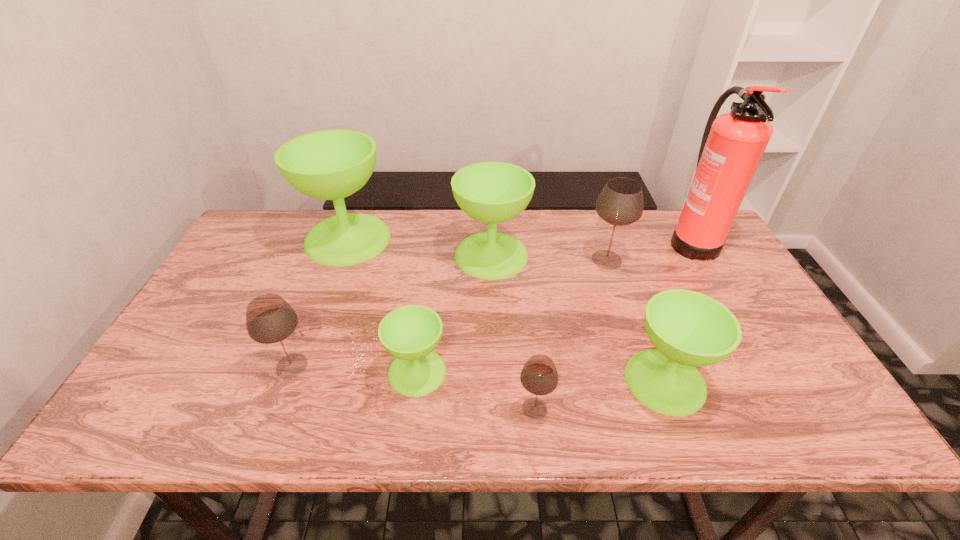
Identify the location of the third closest object to the second biggest green wineglass. (410, 333).

Locate an element on the screen. The width and height of the screenshot is (960, 540). the third closest wineglass relative to the sixth object from right to left is located at coordinates (491, 192).

I want to click on wineglass that stands as the third closest to the second biggest green wineglass, so click(x=410, y=333).

Locate an element on the screen. green wineglass that stands as the closest to the fifth wineglass from right to left is located at coordinates (491, 192).

Image resolution: width=960 pixels, height=540 pixels. I want to click on green wineglass that is the nearest to the second biggest green wineglass, so click(330, 164).

I want to click on the second closest gray wineglass relative to the nearest gray wineglass, so click(270, 319).

The image size is (960, 540). In order to click on gray wineglass that is the third closest to the third biggest green wineglass in this screenshot , I will do `click(270, 319)`.

At what (x,y) coordinates should I click in order to perform the action: click on free location that satisfies the following two spatial constraints: 1. on the front side of the second gray wineglass from left to right; 2. on the right side of the smallest green wineglass. Please return your answer as a coordinate pair (x, y). Looking at the image, I should click on (413, 408).

This screenshot has width=960, height=540. I want to click on free space that satisfies the following two spatial constraints: 1. at the nozzle of the red fire extinguisher; 2. on the front side of the third object from left to right, so click(768, 372).